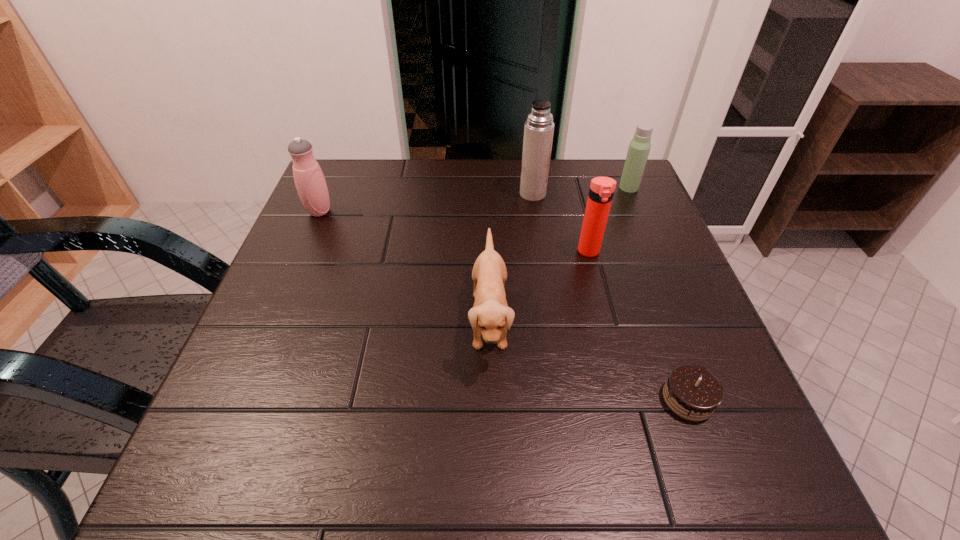
I want to click on the tallest object, so click(x=539, y=127).

Where is `the second thermos bottle from left to right`? This screenshot has width=960, height=540. the second thermos bottle from left to right is located at coordinates (539, 127).

Find the location of a particular element. the leftmost thermos bottle is located at coordinates (309, 179).

Where is `the leftmost object`? the leftmost object is located at coordinates (309, 179).

Find the location of a particular element. This screenshot has height=540, width=960. the third object from right to left is located at coordinates (601, 191).

Image resolution: width=960 pixels, height=540 pixels. What are the coordinates of `the third nearest object` in the screenshot? It's located at point(601,191).

Image resolution: width=960 pixels, height=540 pixels. I want to click on the rightmost thermos bottle, so click(x=639, y=147).

This screenshot has height=540, width=960. In order to click on the second shortest object in this screenshot , I will do `click(491, 316)`.

At what (x,y) coordinates should I click in order to perform the action: click on puppy. Please return your answer as a coordinate pair (x, y). Looking at the image, I should click on (491, 316).

What are the coordinates of `the shortest object` in the screenshot? It's located at (692, 392).